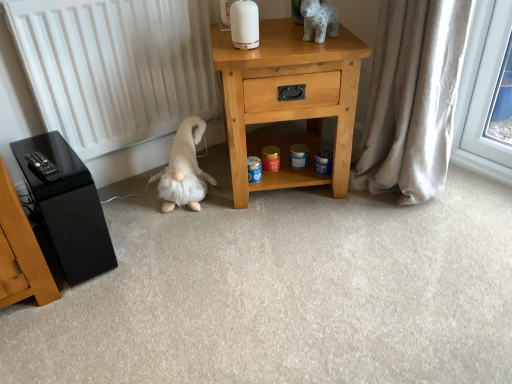
The image size is (512, 384). Identify the location of blank space to the left of fluffy white plush at lower left, placed as the second animal when sorted from right to left. (124, 205).